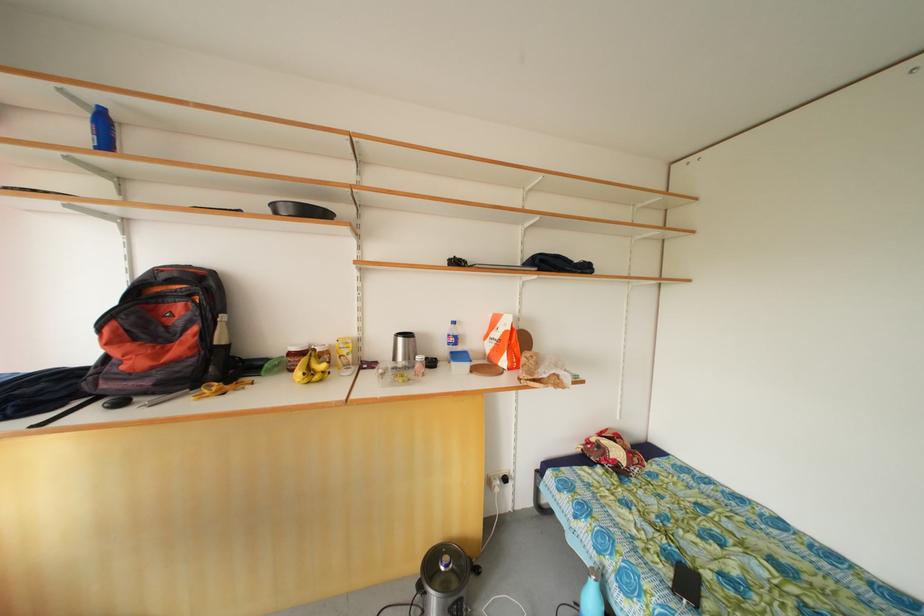
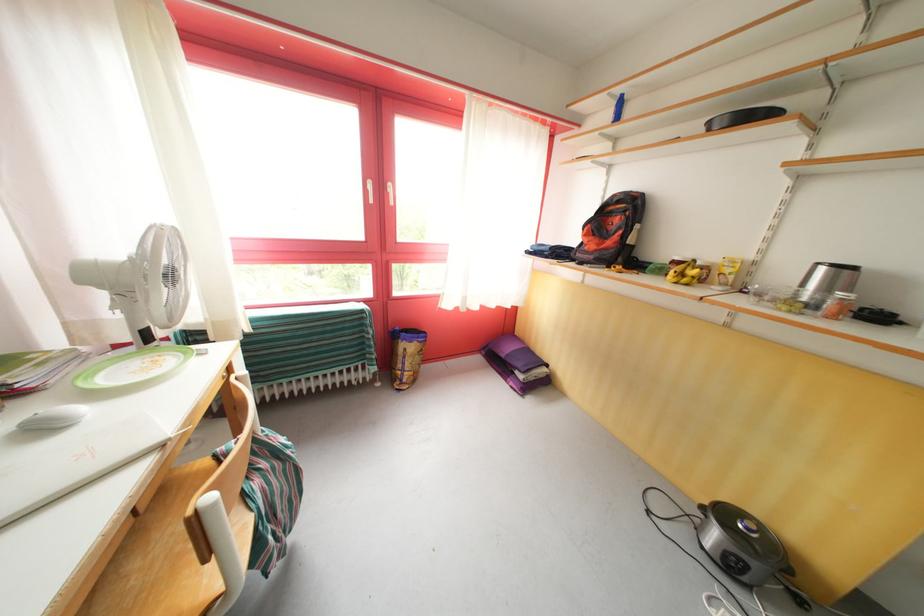
In the second image, find the point that corresponds to [454,572] in the first image.

(755, 535)